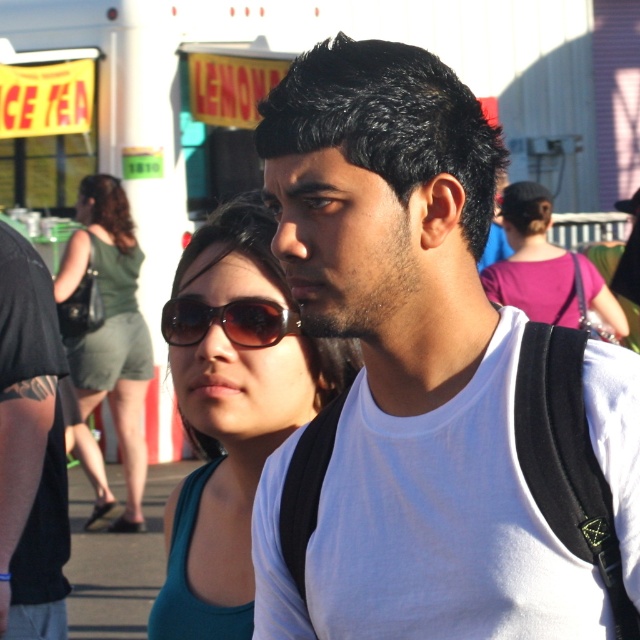
Question: Is purple fabric shirt at upper right positioned before brown reflective sunglasses at center?

Choices:
 (A) yes
 (B) no

Answer: (B)

Question: Which of the following is the closest to the observer?

Choices:
 (A) (486, 266)
 (B) (364, 339)
 (C) (164, 509)

Answer: (B)

Question: Does purple fabric shirt at upper right appear on the left side of brown reflective sunglasses at center?

Choices:
 (A) no
 (B) yes

Answer: (A)

Question: Observing the image, what is the correct spatial positioning of green fabric dress at left in reference to purple fabric shirt at upper right?

Choices:
 (A) right
 (B) left

Answer: (B)

Question: Estimate the real-world distances between objects in this image. Which object is closer to the brown reflective sunglasses at center?

Choices:
 (A) white matte tank top at center
 (B) purple fabric shirt at upper right
 (C) teal fabric sunglasses at center
 (D) green fabric dress at left

Answer: (C)

Question: Which point is closer to the camera taking this photo?

Choices:
 (A) (432, 326)
 (B) (513, 253)
 (C) (253, 260)
 (D) (148, 346)

Answer: (A)